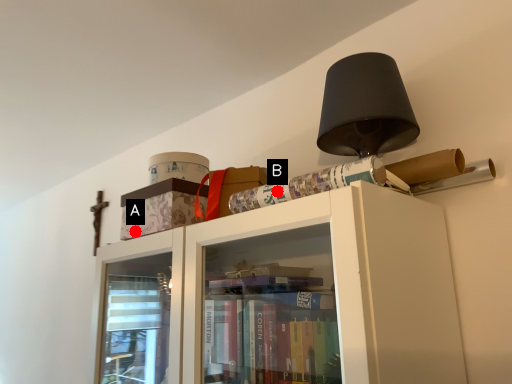
Question: Two points are circled on the image, labeled by A and B beside each circle. Which point is closer to the camera taking this photo?

Choices:
 (A) A is closer
 (B) B is closer

Answer: (B)